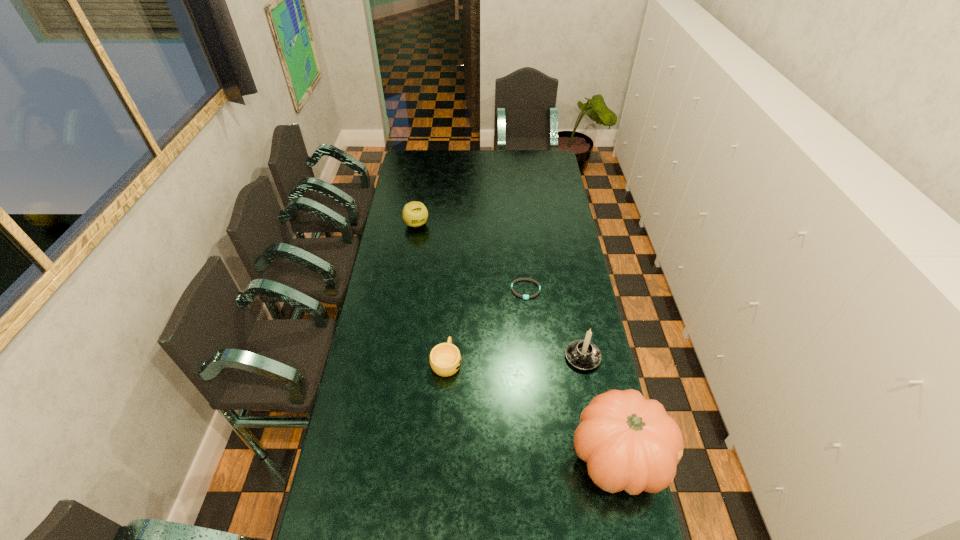
Image resolution: width=960 pixels, height=540 pixels. Find the location of `vacant space located on the buckle of the second farthest object`. vacant space located on the buckle of the second farthest object is located at coordinates (531, 316).

Where is `vacant area situated on the buckle of the second farthest object`? Image resolution: width=960 pixels, height=540 pixels. vacant area situated on the buckle of the second farthest object is located at coordinates (533, 328).

Image resolution: width=960 pixels, height=540 pixels. What are the coordinates of `vacant space located 0.130m on the buckle of the second farthest object` in the screenshot? It's located at (532, 324).

Identify the location of vacant space situated 0.350m on the logo side of the leftmost object. Image resolution: width=960 pixels, height=540 pixels. (444, 278).

This screenshot has height=540, width=960. What are the coordinates of `vacant space located on the logo side of the leftmost object` in the screenshot? It's located at (447, 283).

Where is `free space located 0.140m on the logo side of the leftmost object`? Image resolution: width=960 pixels, height=540 pixels. free space located 0.140m on the logo side of the leftmost object is located at coordinates (429, 249).

You are a GUI agent. You are given a task and a screenshot of the screen. Output one action in this format:
    pyautogui.click(x=<x>, y=<y>)
    Task: Click on the vacant space located 0.180m with a handle on the side of the fourth shortest object
    The image size is (960, 540).
    Given the screenshot: What is the action you would take?
    pyautogui.click(x=530, y=388)

Find the location of a particular element. vacant space located with a handle on the side of the fourth shortest object is located at coordinates (516, 396).

Locate an element on the screen. free space located 0.080m with a handle on the side of the fourth shortest object is located at coordinates (552, 375).

You are a GUI agent. You are given a task and a screenshot of the screen. Output one action in this format:
    pyautogui.click(x=<x>, y=<y>)
    Task: Click on the object situated at the near edge
    The image size is (960, 540).
    Given the screenshot: What is the action you would take?
    pyautogui.click(x=630, y=443)